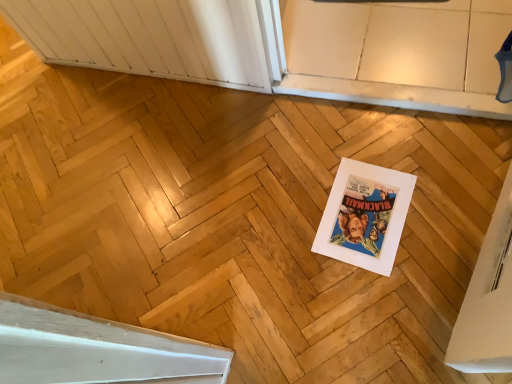
This screenshot has width=512, height=384. Find the location of `free space in front of white paper comic book at center`. free space in front of white paper comic book at center is located at coordinates (399, 293).